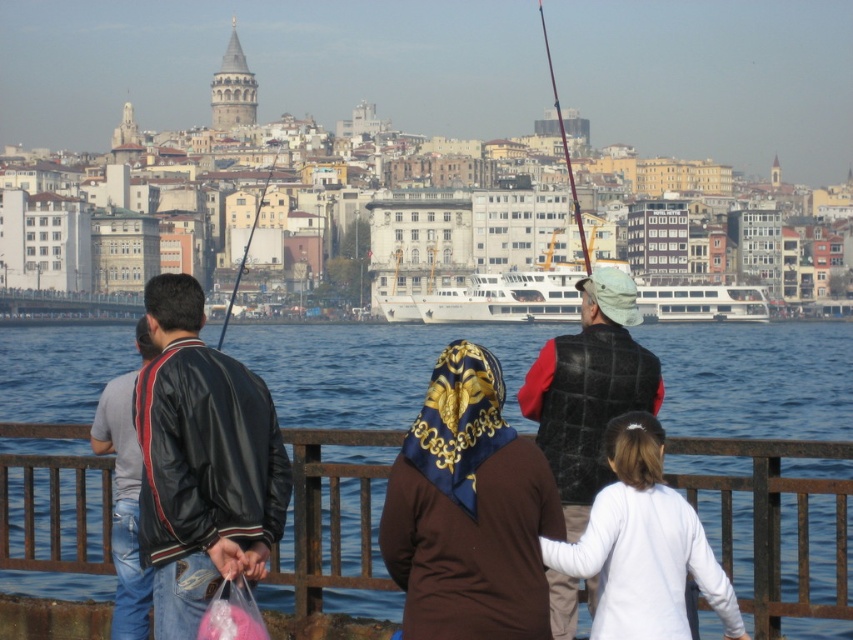
What is the color of the shirt at the point with coordinates (x=643, y=545)?

The point at coordinates (x=643, y=545) is on a white matte shirt at center.

You are a photographer positioned at the origin point of the image. You want to capture a closeup shot of the brown silk headscarf at center. Which direction should you move your camera to focus on it?

The brown silk headscarf at center is located at point 0.798 on the x axis and 0.550 on the y axis. Since the origin is at the bottom left corner, you should move your camera to the right and slightly upwards to focus on it.

You are a photographer standing at the waterfront scene. You want to take a photo that includes both the brown silk headscarf at center and the white glossy ferry at center. Which object will appear larger in your photo?

The brown silk headscarf at center will appear larger in the photo because it is closer to the viewer than the white glossy ferry at center.